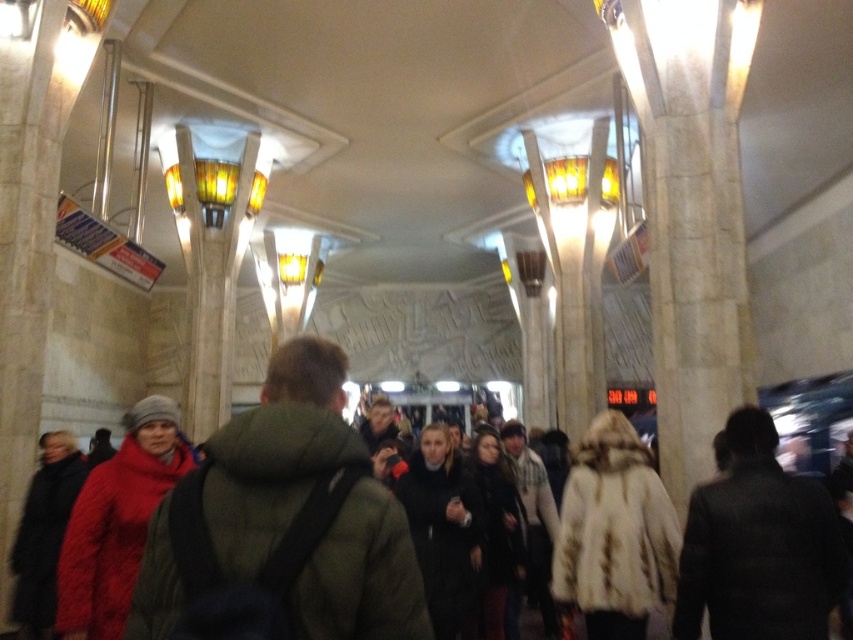
Question: Does dark gray coat at center appear on the right side of fur coat at center?

Choices:
 (A) yes
 (B) no

Answer: (A)

Question: Which point is closer to the camera?

Choices:
 (A) fur coat at center
 (B) matte green jacket at center
 (C) matte red coat at center

Answer: (B)

Question: Does matte green jacket at center appear under matte red coat at center?

Choices:
 (A) no
 (B) yes

Answer: (A)

Question: Observing the image, what is the correct spatial positioning of fur coat at center in reference to matte red coat at center?

Choices:
 (A) above
 (B) below

Answer: (A)

Question: Which of the following is the farthest from the observer?

Choices:
 (A) (113, 468)
 (B) (614, 444)
 (C) (234, 564)

Answer: (B)

Question: Considering the real-world distances, which object is closest to the matte green jacket at center?

Choices:
 (A) fur coat at center
 (B) matte red coat at center
 (C) dark gray coat at center

Answer: (B)